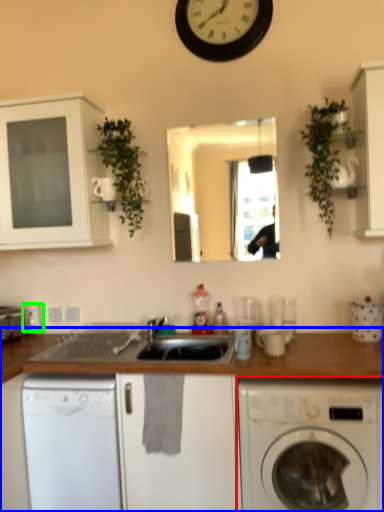
Question: Estimate the real-world distances between objects in this image. Which object is closer to washing machine (highlighted by a red box), countertop (highlighted by a blue box) or electric outlet (highlighted by a green box)?

Choices:
 (A) countertop
 (B) electric outlet

Answer: (A)